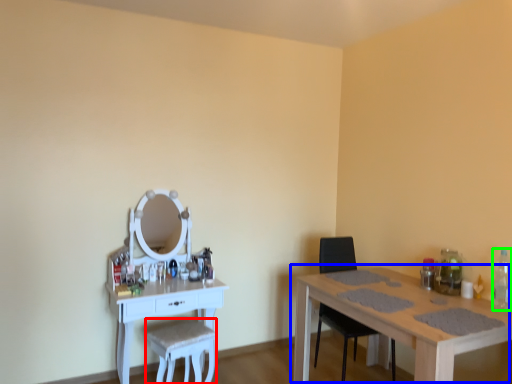
Question: Which is farther away from swivel chair (highlighted by a red box)? table (highlighted by a blue box) or bottle (highlighted by a green box)?

Choices:
 (A) table
 (B) bottle

Answer: (B)